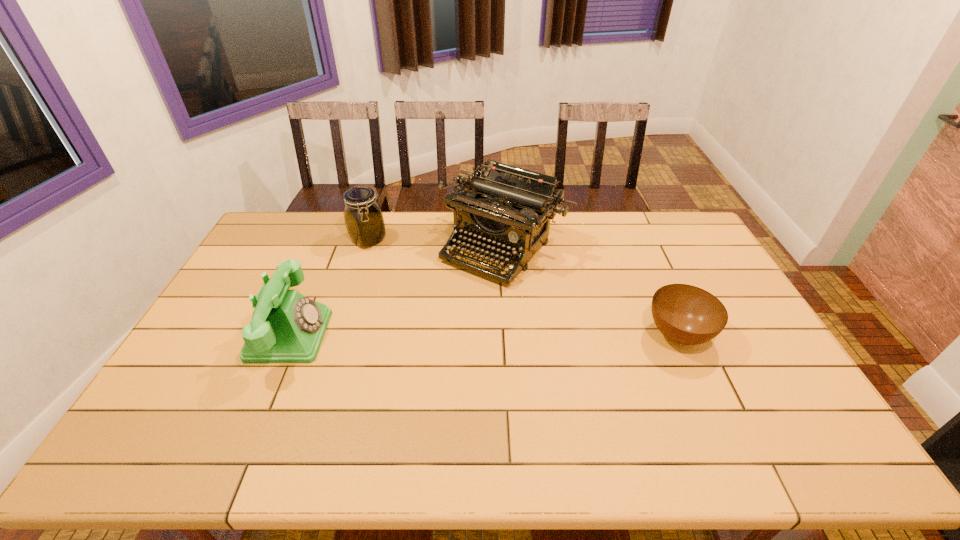
Identify the location of free space on the desktop that is between the telephone and the bowl and is positioned on the lid of the jar. (496, 335).

Where is `vacant spot on the desktop that is between the telephone and the rightmost object and is positioned on the keyboard of the tallest object`? The image size is (960, 540). vacant spot on the desktop that is between the telephone and the rightmost object and is positioned on the keyboard of the tallest object is located at coordinates (426, 335).